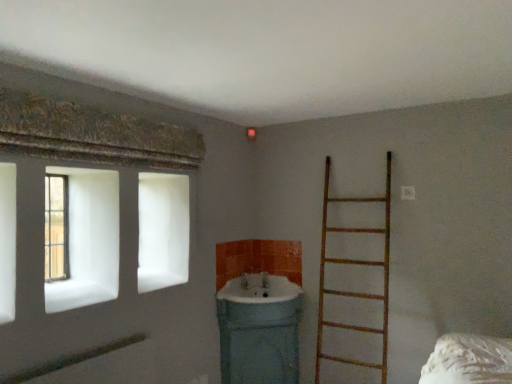
Question: In terms of size, does white glossy sink at center, placed as the 2th sink when sorted from bottom to top, appear bigger or smaller than wooden frame window at left?

Choices:
 (A) small
 (B) big

Answer: (B)

Question: In the image, is white glossy sink at center, the 1th sink viewed from the top, positioned in front of or behind wooden frame window at left?

Choices:
 (A) front
 (B) behind

Answer: (B)

Question: Estimate the real-world distances between objects in this image. Which object is closer to the wooden frame window at left?

Choices:
 (A) matte white sink at center, the 2th sink from the top
 (B) white glossy sink at center, the 1th sink viewed from the top
 (C) wooden ladder at right

Answer: (B)

Question: Considering the real-world distances, which object is closest to the wooden ladder at right?

Choices:
 (A) wooden frame window at left
 (B) matte white sink at center, arranged as the first sink when ordered from the bottom
 (C) white glossy sink at center, the 1th sink viewed from the top

Answer: (B)